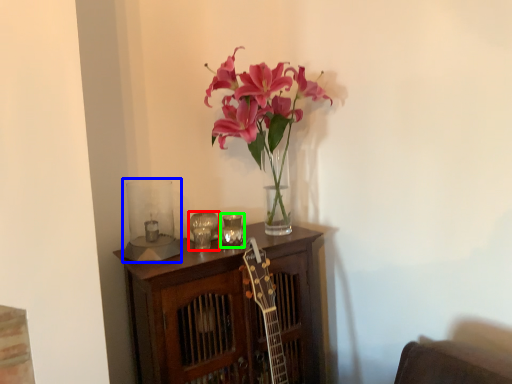
Question: Which object is positioned farthest from candle holder (highlighted by a red box)? Select from candle holder (highlighted by a blue box) and candle holder (highlighted by a green box).

Choices:
 (A) candle holder
 (B) candle holder

Answer: (A)